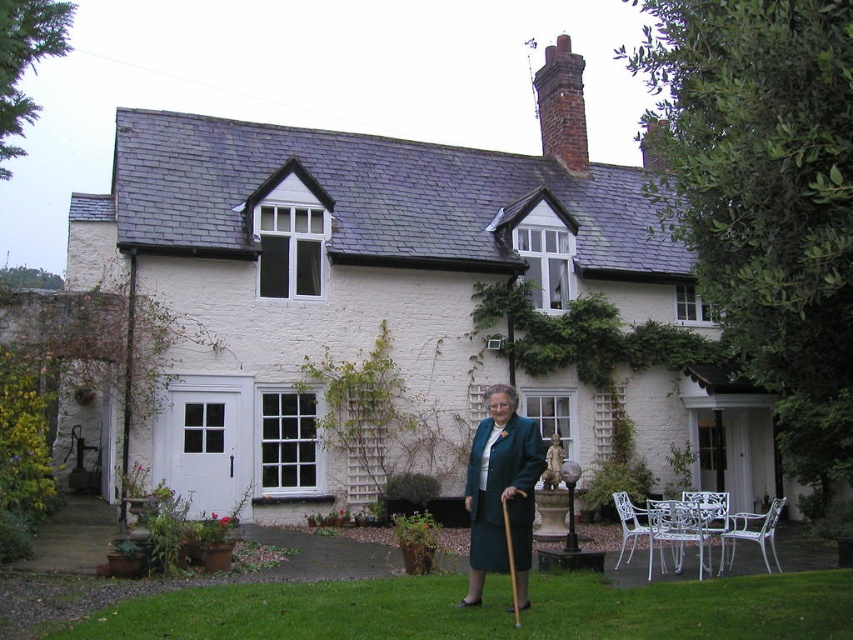
Who is more distant from viewer, (601, 637) or (480, 588)?

The point (480, 588) is behind.

I want to click on green grass at lower center, so click(x=488, y=611).

Is point (311, 625) less distant than point (498, 412)?

Yes, point (311, 625) is closer to viewer.

Identify the location of green grass at lower center. The image size is (853, 640). (488, 611).

Locate an element on the screen. Image resolution: width=853 pixels, height=640 pixels. white painted brick cottage at center is located at coordinates (363, 273).

Is white painted brick cottage at center behind green grass at lower center?

Yes, white painted brick cottage at center is behind green grass at lower center.

What do you see at coordinates (363, 273) in the screenshot? I see `white painted brick cottage at center` at bounding box center [363, 273].

I want to click on white painted brick cottage at center, so click(363, 273).

Can you confirm if white painted brick cottage at center is smaller than teal fabric coat at center?

Actually, white painted brick cottage at center might be larger than teal fabric coat at center.

Between white painted brick cottage at center and teal fabric coat at center, which one appears on the right side from the viewer's perspective?

From the viewer's perspective, teal fabric coat at center appears more on the right side.

The height and width of the screenshot is (640, 853). Identify the location of white painted brick cottage at center. (363, 273).